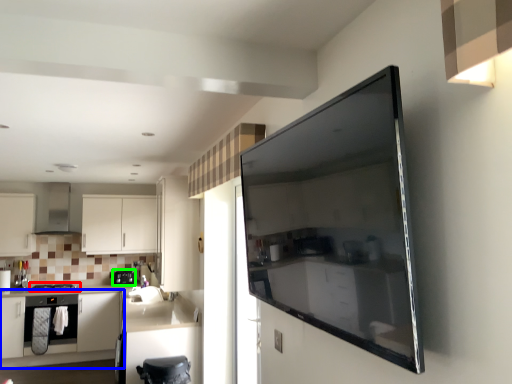
Question: Based on their relative distances, which object is nearer to home appliance (highlighted by a red box)? Choose from cabinetry (highlighted by a blue box) and kitchen appliance (highlighted by a green box).

Choices:
 (A) cabinetry
 (B) kitchen appliance

Answer: (A)